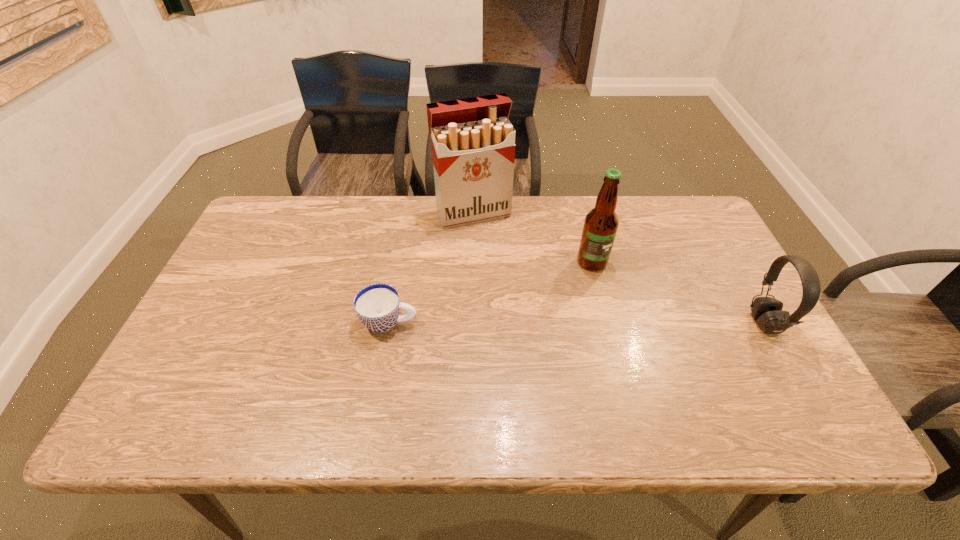
Find the location of a particular element. vacant region at the far edge of the desktop is located at coordinates (483, 234).

Identify the location of free space at the left edge of the desktop. The width and height of the screenshot is (960, 540). (237, 330).

In the image, there is a desktop. Identify the location of vacant space at the right edge. pos(702,249).

I want to click on vacant region at the far right corner of the desktop, so click(656, 217).

What are the coordinates of `vacant point located between the rightmost object and the leftmost object` in the screenshot? It's located at (577, 323).

Where is `empty location between the third shortest object and the second shortest object`? This screenshot has width=960, height=540. empty location between the third shortest object and the second shortest object is located at coordinates (678, 293).

Identify the location of vacant space in between the second farthest object and the farthest object. (533, 238).

At what (x,y) coordinates should I click in order to perform the action: click on vacant area between the second object from left to right and the beer bottle. Please return your answer as a coordinate pair (x, y). The height and width of the screenshot is (540, 960). Looking at the image, I should click on (533, 238).

The height and width of the screenshot is (540, 960). I want to click on free area in between the cup and the second object from right to left, so click(x=491, y=292).

Find the location of `blank region between the second tallest object and the farthest object`. blank region between the second tallest object and the farthest object is located at coordinates click(x=533, y=238).